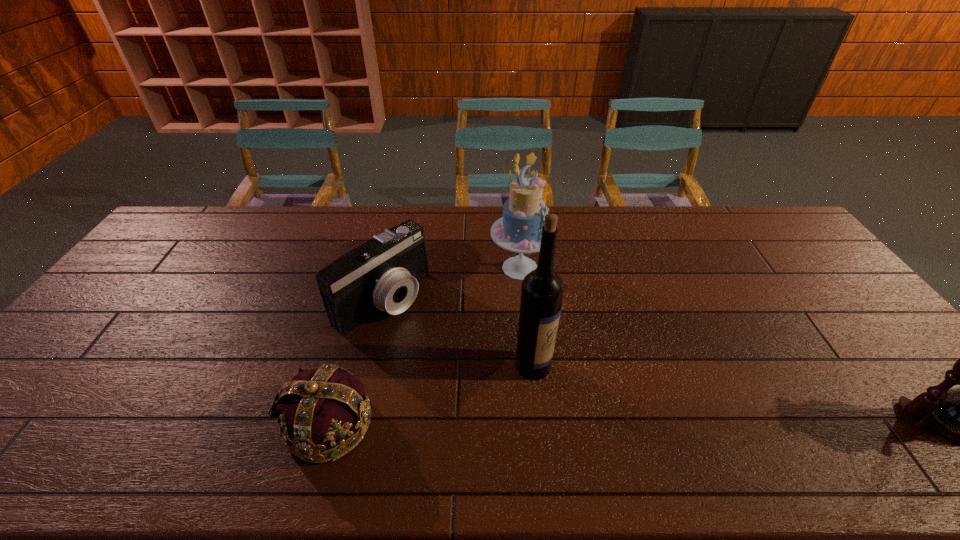
Locate an element on the screen. The height and width of the screenshot is (540, 960). the shortest object is located at coordinates (325, 412).

At what (x,y) coordinates should I click in order to perform the action: click on the third nearest object. Please return your answer as a coordinate pair (x, y). Image resolution: width=960 pixels, height=540 pixels. Looking at the image, I should click on (542, 289).

Where is `camcorder`? camcorder is located at coordinates (383, 273).

The image size is (960, 540). Find the location of `the second tallest object`. the second tallest object is located at coordinates (519, 230).

The width and height of the screenshot is (960, 540). In order to click on vacant space located on the right of the shortest object in this screenshot , I will do `click(485, 423)`.

The width and height of the screenshot is (960, 540). What are the coordinates of `vacant space located 0.240m on the label of the third nearest object` in the screenshot? It's located at (644, 418).

Locate an element on the screen. Image resolution: width=960 pixels, height=540 pixels. free space located 0.240m on the label of the third nearest object is located at coordinates (644, 418).

The width and height of the screenshot is (960, 540). I want to click on free space located on the label of the third nearest object, so click(636, 415).

Find the location of a particular element. vacant region located 0.190m on the lens of the fourth tallest object is located at coordinates (461, 358).

The image size is (960, 540). Identify the location of vacant region located 0.240m on the lens of the fourth tallest object. (475, 369).